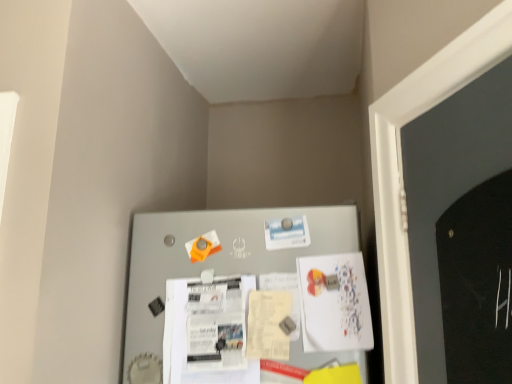
Image resolution: width=512 pixels, height=384 pixels. What do you see at coordinates (216, 257) in the screenshot?
I see `metallic gray bulletin board at center` at bounding box center [216, 257].

What do you see at coordinates (208, 332) in the screenshot? I see `white paper poster at center, positioned as the 1th poster in left-to-right order` at bounding box center [208, 332].

At what (x,y) coordinates should I click in order to perform the action: click on white paper poster at center, the first poster when ordered from right to left. Please return your answer as a coordinate pair (x, y). Image resolution: width=512 pixels, height=384 pixels. Looking at the image, I should click on (334, 303).

How many degrees apart are the facing directions of white paper poster at center, the first poster when ordered from right to left, and metallic gray bulletin board at center?

There is a 2.72-degree angle between the facing directions of white paper poster at center, the first poster when ordered from right to left, and metallic gray bulletin board at center.

Is the surface of white paper poster at center, which appears as the second poster when viewed from the left, in direct contact with metallic gray bulletin board at center?

No, white paper poster at center, which appears as the second poster when viewed from the left, is not next to metallic gray bulletin board at center.

Between white paper poster at center, the first poster when ordered from right to left, and metallic gray bulletin board at center, which one appears on the right side from the viewer's perspective?

Positioned to the right is white paper poster at center, the first poster when ordered from right to left.

Is white paper poster at center, which appears as the second poster when viewed from the left, inside the boundaries of metallic gray bulletin board at center, or outside?

white paper poster at center, which appears as the second poster when viewed from the left, is inside metallic gray bulletin board at center.

Can you confirm if white paper poster at center, the first poster when ordered from right to left, is thinner than white paper poster at center, positioned as the 1th poster in left-to-right order?

Yes.

Considering the relative positions of white paper poster at center, the first poster when ordered from right to left, and white paper poster at center, positioned as the 1th poster in left-to-right order, in the image provided, is white paper poster at center, the first poster when ordered from right to left, to the left or to the right of white paper poster at center, positioned as the 1th poster in left-to-right order,?

white paper poster at center, the first poster when ordered from right to left, is to the right of white paper poster at center, positioned as the 1th poster in left-to-right order.

Considering the sizes of objects white paper poster at center, which appears as the second poster when viewed from the left, and white paper poster at center, the 2th poster positioned from the right, in the image provided, who is shorter, white paper poster at center, which appears as the second poster when viewed from the left, or white paper poster at center, the 2th poster positioned from the right,?

With less height is white paper poster at center, which appears as the second poster when viewed from the left.

Is white paper poster at center, which appears as the second poster when viewed from the left, positioned behind white paper poster at center, positioned as the 1th poster in left-to-right order?

Yes, white paper poster at center, which appears as the second poster when viewed from the left, is behind white paper poster at center, positioned as the 1th poster in left-to-right order.

In the scene shown: Is metallic gray bulletin board at center at the right side of white paper poster at center, which appears as the second poster when viewed from the left?

In fact, metallic gray bulletin board at center is to the left of white paper poster at center, which appears as the second poster when viewed from the left.

How distant is metallic gray bulletin board at center from white paper poster at center, the first poster when ordered from right to left?

A distance of 6.76 inches exists between metallic gray bulletin board at center and white paper poster at center, the first poster when ordered from right to left.

Is white paper poster at center, the first poster when ordered from right to left, at the back of metallic gray bulletin board at center?

Yes, white paper poster at center, the first poster when ordered from right to left, is at the back of metallic gray bulletin board at center.

Which object is more forward, metallic gray bulletin board at center or white paper poster at center, the first poster when ordered from right to left?

metallic gray bulletin board at center is more forward.

Measure the distance from metallic gray bulletin board at center to white paper poster at center, positioned as the 1th poster in left-to-right order.

They are 4.16 inches apart.

Considering the sizes of metallic gray bulletin board at center and white paper poster at center, the 2th poster positioned from the right, in the image, is metallic gray bulletin board at center taller or shorter than white paper poster at center, the 2th poster positioned from the right,?

In the image, metallic gray bulletin board at center appears to be taller than white paper poster at center, the 2th poster positioned from the right.

From the image's perspective, would you say metallic gray bulletin board at center is shown under white paper poster at center, positioned as the 1th poster in left-to-right order?

Incorrect, from the image's perspective, metallic gray bulletin board at center is higher than white paper poster at center, positioned as the 1th poster in left-to-right order.

From a real-world perspective, is metallic gray bulletin board at center over white paper poster at center, positioned as the 1th poster in left-to-right order?

Yes, from a real-world perspective, metallic gray bulletin board at center is on top of white paper poster at center, positioned as the 1th poster in left-to-right order.

How many degrees apart are the facing directions of white paper poster at center, the 2th poster positioned from the right, and metallic gray bulletin board at center?

The angular difference between white paper poster at center, the 2th poster positioned from the right, and metallic gray bulletin board at center is 2.72 degrees.

Which of these two, white paper poster at center, the 2th poster positioned from the right, or metallic gray bulletin board at center, stands shorter?

white paper poster at center, the 2th poster positioned from the right, is shorter.

From the image's perspective, which one is positioned higher, white paper poster at center, the 2th poster positioned from the right, or metallic gray bulletin board at center?

From the image's view, metallic gray bulletin board at center is above.

Between white paper poster at center, positioned as the 1th poster in left-to-right order, and metallic gray bulletin board at center, which one is positioned in front?

Positioned in front is metallic gray bulletin board at center.

Based on the photo, can you confirm if white paper poster at center, positioned as the 1th poster in left-to-right order, is positioned to the right of white paper poster at center, which appears as the second poster when viewed from the left?

No.

Is white paper poster at center, positioned as the 1th poster in left-to-right order, looking in the opposite direction of white paper poster at center, which appears as the second poster when viewed from the left?

No, white paper poster at center, positioned as the 1th poster in left-to-right order, is not facing the opposite direction of white paper poster at center, which appears as the second poster when viewed from the left.

The image size is (512, 384). In order to click on bulletin board in front of the white paper poster at center, which appears as the second poster when viewed from the left in this screenshot , I will do `click(216, 257)`.

Where is `poster directly beneath the white paper poster at center, the first poster when ordered from right to left (from a real-world perspective)`? This screenshot has height=384, width=512. poster directly beneath the white paper poster at center, the first poster when ordered from right to left (from a real-world perspective) is located at coordinates (208, 332).

Based on their spatial positions, is white paper poster at center, positioned as the 1th poster in left-to-right order, or white paper poster at center, the first poster when ordered from right to left, further from metallic gray bulletin board at center?

Among the two, white paper poster at center, the first poster when ordered from right to left, is located further to metallic gray bulletin board at center.

Based on their spatial positions, is white paper poster at center, positioned as the 1th poster in left-to-right order, or metallic gray bulletin board at center closer to white paper poster at center, the first poster when ordered from right to left?

Among the two, metallic gray bulletin board at center is located nearer to white paper poster at center, the first poster when ordered from right to left.

Estimate the real-world distances between objects in this image. Which object is further from metallic gray bulletin board at center, white paper poster at center, which appears as the second poster when viewed from the left, or white paper poster at center, positioned as the 1th poster in left-to-right order?

Based on the image, white paper poster at center, which appears as the second poster when viewed from the left, appears to be further to metallic gray bulletin board at center.

Based on their spatial positions, is metallic gray bulletin board at center or white paper poster at center, which appears as the second poster when viewed from the left, closer to white paper poster at center, the 2th poster positioned from the right?

metallic gray bulletin board at center is positioned closer to the anchor white paper poster at center, the 2th poster positioned from the right.

Based on the photo, from the image, which object appears to be farther from white paper poster at center, the 2th poster positioned from the right, white paper poster at center, the first poster when ordered from right to left, or metallic gray bulletin board at center?

white paper poster at center, the first poster when ordered from right to left.

Estimate the real-world distances between objects in this image. Which object is closer to white paper poster at center, which appears as the second poster when viewed from the left, metallic gray bulletin board at center or white paper poster at center, positioned as the 1th poster in left-to-right order?

metallic gray bulletin board at center is positioned closer to the anchor white paper poster at center, which appears as the second poster when viewed from the left.

Where is `bulletin board situated between white paper poster at center, the 2th poster positioned from the right, and white paper poster at center, which appears as the second poster when viewed from the left, from left to right`? bulletin board situated between white paper poster at center, the 2th poster positioned from the right, and white paper poster at center, which appears as the second poster when viewed from the left, from left to right is located at coordinates (216, 257).